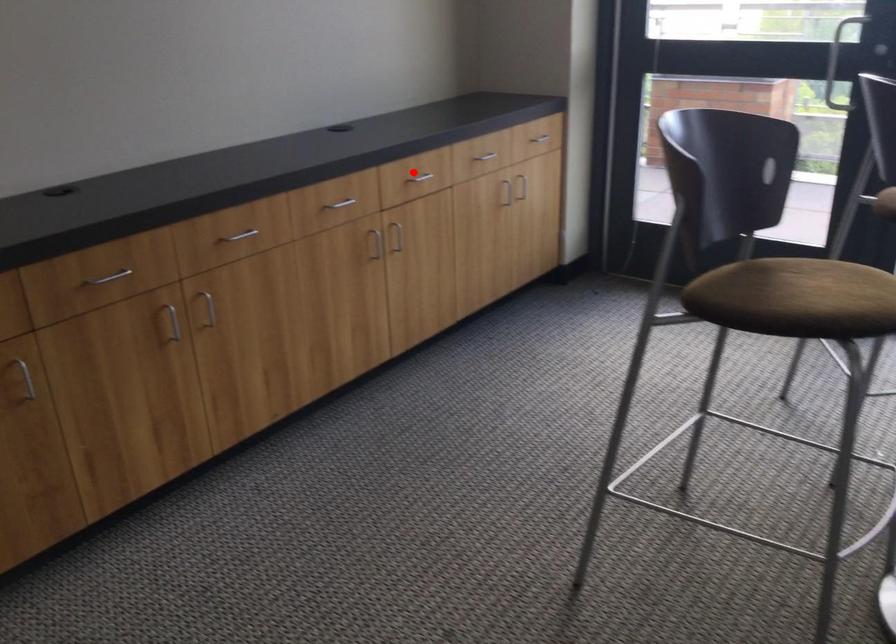
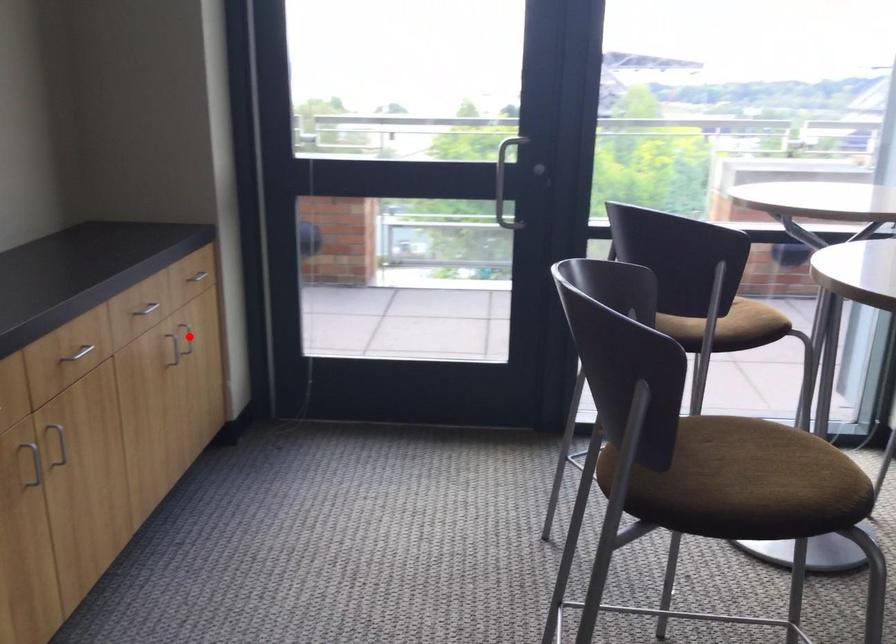
I am providing you with two images of the same scene from different viewpoints. A red point is marked on the first image and another point is marked on the second image. Does the point marked in image1 correspond to the same location as the one in image2?

No